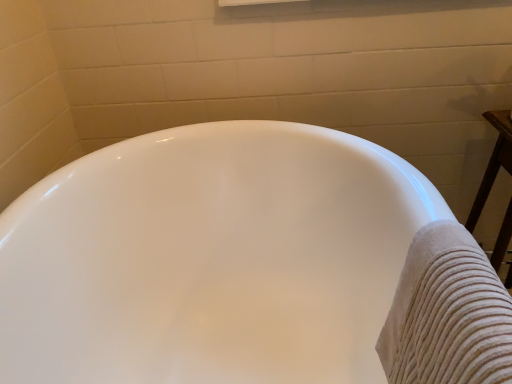
Question: Considering the relative sizes of white glossy bathtub at center and beige textured towel at right in the image provided, is white glossy bathtub at center smaller than beige textured towel at right?

Choices:
 (A) no
 (B) yes

Answer: (A)

Question: From a real-world perspective, does white glossy bathtub at center stand above beige textured towel at right?

Choices:
 (A) no
 (B) yes

Answer: (A)

Question: Does white glossy bathtub at center contain beige textured towel at right?

Choices:
 (A) yes
 (B) no

Answer: (A)

Question: From a real-world perspective, is white glossy bathtub at center beneath beige textured towel at right?

Choices:
 (A) no
 (B) yes

Answer: (B)

Question: Considering the relative sizes of white glossy bathtub at center and beige textured towel at right in the image provided, is white glossy bathtub at center shorter than beige textured towel at right?

Choices:
 (A) no
 (B) yes

Answer: (A)

Question: Considering the relative sizes of white glossy bathtub at center and beige textured towel at right in the image provided, is white glossy bathtub at center bigger than beige textured towel at right?

Choices:
 (A) no
 (B) yes

Answer: (B)

Question: Can you confirm if beige textured towel at right is wider than white glossy bathtub at center?

Choices:
 (A) yes
 (B) no

Answer: (B)

Question: From a real-world perspective, is beige textured towel at right positioned under white glossy bathtub at center based on gravity?

Choices:
 (A) no
 (B) yes

Answer: (A)

Question: Is beige textured towel at right not near white glossy bathtub at center?

Choices:
 (A) no
 (B) yes

Answer: (A)

Question: Can you confirm if beige textured towel at right is taller than white glossy bathtub at center?

Choices:
 (A) yes
 (B) no

Answer: (B)

Question: Does beige textured towel at right have a lesser height compared to white glossy bathtub at center?

Choices:
 (A) yes
 (B) no

Answer: (A)

Question: Is beige textured towel at right positioned with its back to white glossy bathtub at center?

Choices:
 (A) no
 (B) yes

Answer: (B)

Question: Based on their sizes in the image, would you say beige textured towel at right is bigger or smaller than white glossy bathtub at center?

Choices:
 (A) big
 (B) small

Answer: (B)